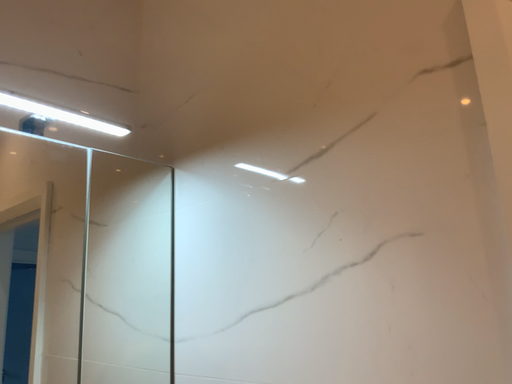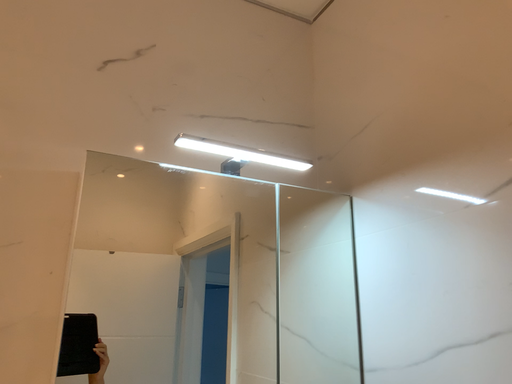
Question: Which way did the camera rotate in the video?

Choices:
 (A) rotated right
 (B) rotated left

Answer: (B)